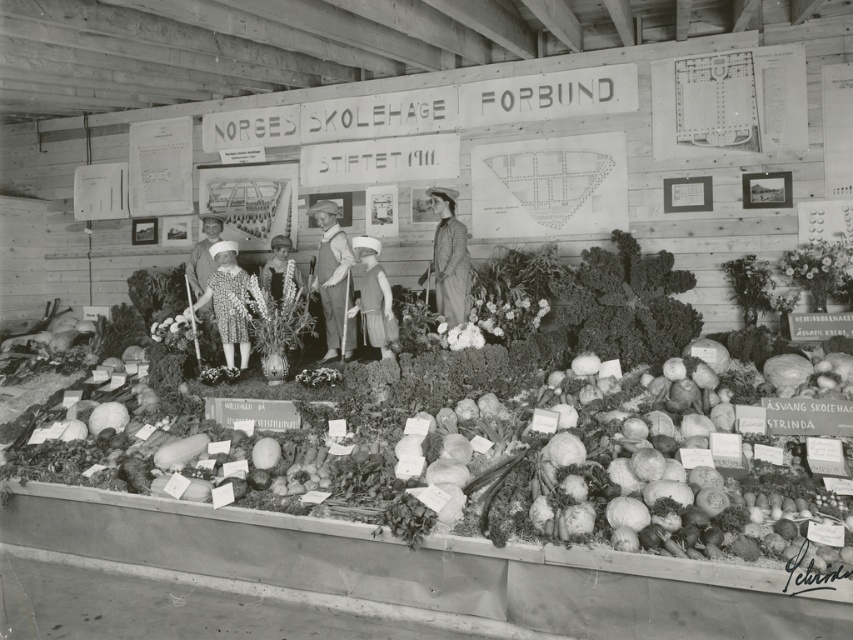
You are a visitor at the fair and want to know if the smooth wooden vase at right can fit inside the matte brown dress at center. Can it?

The smooth wooden vase at right is not as tall as matte brown dress at center, so it can fit inside the matte brown dress at center since it is shorter.

You are a tailor who needs to place a 20 inch wide box between the matte brown coat at center and the matte brown dress at center. Can the box fit in the space between them?

The matte brown coat at center and matte brown dress at center are 21.48 inches apart from each other. Since the box is 20 inches wide, it can fit in the space between them as there is enough room.

You are standing in front of the display at the fair. There are two points marked on the display. The first point is at coordinate [792,250] and the second is at [360,236]. Which point is closer to you?

Point [792,250] is closer to the camera than point [360,236].